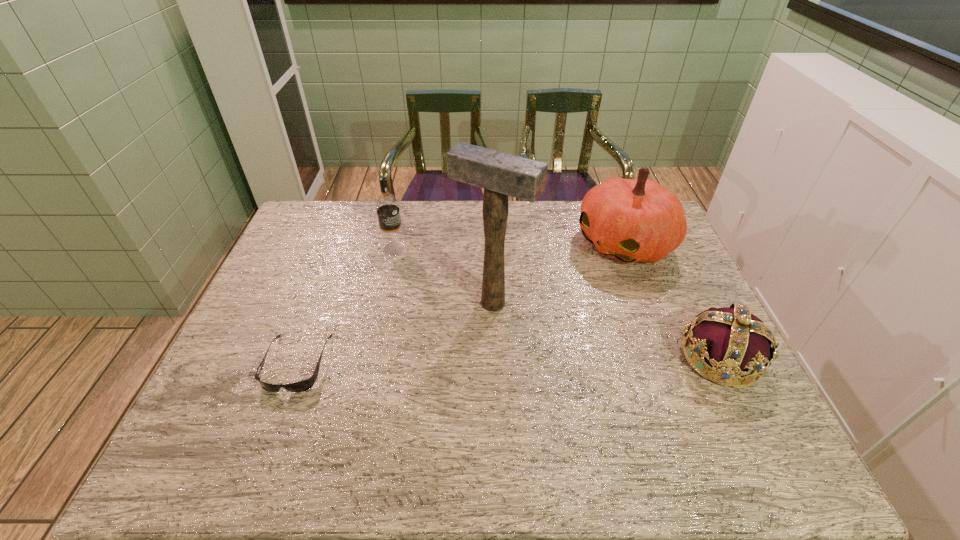
At what (x,y) coordinates should I click in order to perform the action: click on free space on the desktop that is between the leftmost object and the crown and is positioned on the front-facing side of the pumpkin. Please return your answer as a coordinate pair (x, y). This screenshot has width=960, height=540. Looking at the image, I should click on (448, 361).

At what (x,y) coordinates should I click in order to perform the action: click on free space on the desktop that is between the leftmost object and the crown and is positioned on the label of the second object from left to right. Please return your answer as a coordinate pair (x, y). Image resolution: width=960 pixels, height=540 pixels. Looking at the image, I should click on (509, 360).

You are a GUI agent. You are given a task and a screenshot of the screen. Output one action in this format:
    pyautogui.click(x=<x>, y=<y>)
    Task: Click on the vacant space on the desktop that is between the sunglasses and the fourth tallest object and is positioned on the striking surface of the tallest object
    This screenshot has height=540, width=960.
    Given the screenshot: What is the action you would take?
    [450, 361]